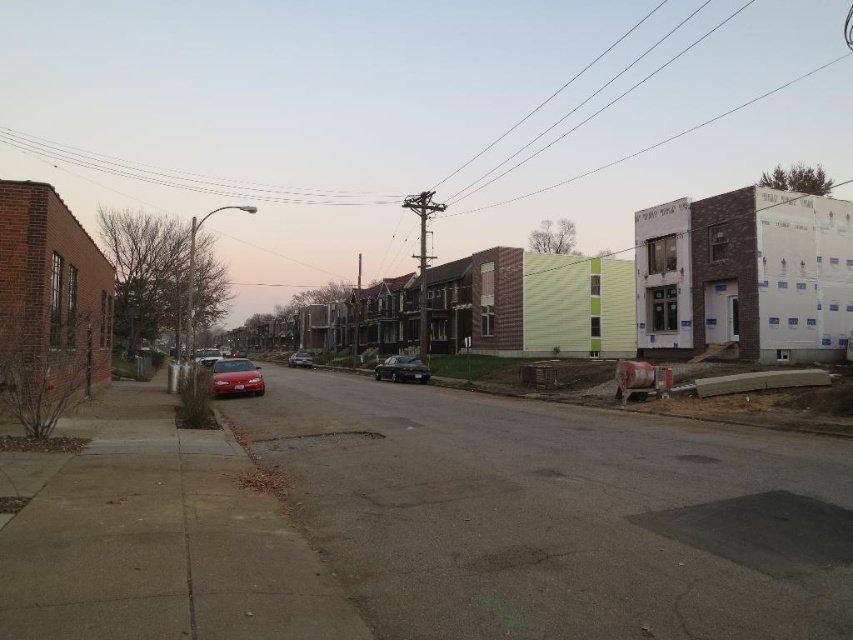
Question: Can you confirm if black wire at upper center is bigger than shiny silver sedan at center?

Choices:
 (A) no
 (B) yes

Answer: (B)

Question: Among these objects, which one is nearest to the camera?

Choices:
 (A) shiny silver sedan at center
 (B) black wire at upper center
 (C) glossy red car at center

Answer: (C)

Question: Does shiny black sedan at center appear under shiny silver sedan at center?

Choices:
 (A) no
 (B) yes

Answer: (A)

Question: Is the position of black wire at upper center more distant than that of shiny black sedan at center?

Choices:
 (A) yes
 (B) no

Answer: (A)

Question: Which point is farther from the camera taking this photo?

Choices:
 (A) (294, 358)
 (B) (483, 182)
 (C) (236, 358)

Answer: (B)

Question: Which object is closer to the camera taking this photo?

Choices:
 (A) smooth wire at upper center
 (B) black wire at upper center
 (C) glossy red car at center
 (D) shiny silver sedan at center

Answer: (C)